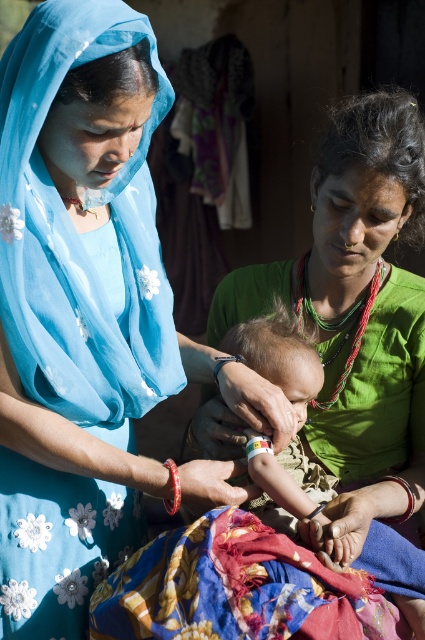
You are a photographer trying to capture a closeup of the multicolored fabric at lower center without including the blue fabric headscarf at upper left in the frame. Based on their positions, is this possible?

The blue fabric headscarf at upper left is to the left of the multicolored fabric at lower center, so moving the camera to the right side of the multicolored fabric at lower center would exclude the blue fabric headscarf at upper left from the frame.

You are a tailor who needs to determine which fabric is more suitable for making a large tablecloth. Based on the image, which fabric between the green fabric at center and the multicolored fabric at lower center would you choose?

The green fabric at center is bigger than the multicolored fabric at lower center, so the green fabric at center would be more suitable for making a large tablecloth.

You are a photographer trying to capture a closeup of the blue fabric headscarf at upper left. Given that your camera can focus on objects within a 0.15 unit radius from the center point, and the center of your frame is currently at point 0.5, 0.5, should you adjust the camera position to ensure the headscarf is in focus?

The blue fabric headscarf at upper left is located at point [85,230]. The distance from the center point [212,320] is sqrt of squared differences. Calculating, the distance is sqrt of 0.138 squared plus 0.298 squared. That is sqrt of 0.019044 plus 0.088804 equals sqrt of 0.107848, which is approximately 0.328 units. Since this exceeds the 0.15 unit focus radius, you need to adjust the camera position closer to the headscarf to ensure it is in focus.